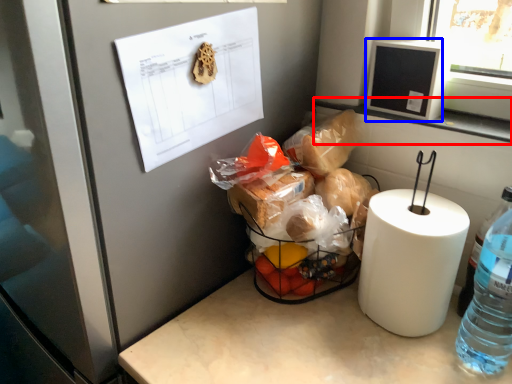
Question: Which object is further to the camera taking this photo, window sill (highlighted by a red box) or window screen (highlighted by a blue box)?

Choices:
 (A) window sill
 (B) window screen

Answer: (B)